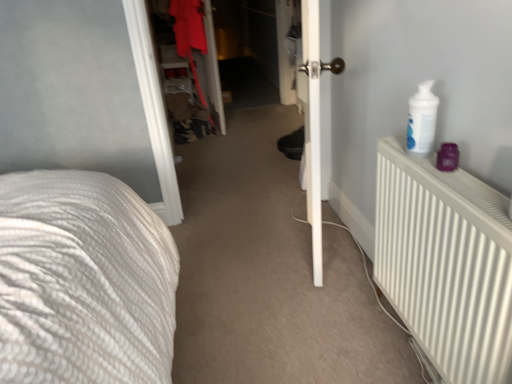
What do you see at coordinates (445, 263) in the screenshot? I see `white matte radiator at right` at bounding box center [445, 263].

Locate an element on the screen. This screenshot has height=384, width=512. white smooth door at center is located at coordinates (314, 124).

From a real-world perspective, who is located lower, matte red coat at center or white smooth door at center?

white smooth door at center is physically lower.

Consider the image. Is matte red coat at center positioned with its back to white smooth door at center?

No, matte red coat at center is not facing away from white smooth door at center.

Is matte red coat at center shorter than white smooth door at center?

Yes, matte red coat at center is shorter than white smooth door at center.

Looking at their sizes, would you say matte red coat at center is wider or thinner than white smooth door at center?

Clearly, matte red coat at center has more width compared to white smooth door at center.

In terms of width, does white smooth door at center look wider or thinner when compared to white matte radiator at right?

Considering their sizes, white smooth door at center looks broader than white matte radiator at right.

Is white matte radiator at right surrounded by white smooth door at center?

No, white matte radiator at right is not a part of white smooth door at center.

From a real-world perspective, who is located higher, white smooth door at center or matte red coat at center?

From a 3D spatial view, matte red coat at center is above.

Between white smooth door at center and matte red coat at center, which one has larger size?

With larger size is matte red coat at center.

Is white smooth door at center with matte red coat at center?

No, white smooth door at center is not making contact with matte red coat at center.

Is white smooth door at center aimed at matte red coat at center?

No, white smooth door at center is not aimed at matte red coat at center.

From a real-world perspective, is white matte radiator at right on white smooth door at center?

No, from a real-world perspective, white matte radiator at right is not over white smooth door at center

Consider the image. Which is more to the left, white matte radiator at right or white smooth door at center?

Positioned to the left is white smooth door at center.

Can you confirm if white matte radiator at right is bigger than white smooth door at center?

No, white matte radiator at right is not bigger than white smooth door at center.

Can you confirm if matte red coat at center is bigger than white matte radiator at right?

Indeed, matte red coat at center has a larger size compared to white matte radiator at right.

In the image, is matte red coat at center positioned in front of or behind white matte radiator at right?

Clearly, matte red coat at center is behind white matte radiator at right.

From a real-world perspective, between matte red coat at center and white matte radiator at right, who is vertically higher?

matte red coat at center.

In terms of height, does matte red coat at center look taller or shorter compared to white matte radiator at right?

Considering their sizes, matte red coat at center has more height than white matte radiator at right.

In the scene shown: Is white matte radiator at right taller than matte red coat at center?

Incorrect, the height of white matte radiator at right is not larger of that of matte red coat at center.

Is white matte radiator at right thinner than matte red coat at center?

Correct, the width of white matte radiator at right is less than that of matte red coat at center.

Does point (482, 234) come closer to viewer compared to point (201, 44)?

That is True.

Image resolution: width=512 pixels, height=384 pixels. Identify the location of clothing above the white matte radiator at right (from the image's perspective). (189, 34).

Locate an element on the screen. door to the right of matte red coat at center is located at coordinates (314, 124).

Where is `door above the white matte radiator at right (from the image's perspective)`? Image resolution: width=512 pixels, height=384 pixels. door above the white matte radiator at right (from the image's perspective) is located at coordinates (314, 124).

From the image, which object appears to be nearer to white smooth door at center, matte red coat at center or white matte radiator at right?

Among the two, white matte radiator at right is located nearer to white smooth door at center.

Based on their spatial positions, is white smooth door at center or matte red coat at center further from white matte radiator at right?

Based on the image, matte red coat at center appears to be further to white matte radiator at right.

Estimate the real-world distances between objects in this image. Which object is closer to white smooth door at center, white matte radiator at right or matte red coat at center?

white matte radiator at right is closer to white smooth door at center.

Based on the photo, considering their positions, is white smooth door at center positioned closer to matte red coat at center than white matte radiator at right?

white smooth door at center is positioned closer to the anchor matte red coat at center.

Looking at the image, which one is located further to matte red coat at center, white matte radiator at right or white smooth door at center?

The object further to matte red coat at center is white matte radiator at right.

Considering their positions, is matte red coat at center positioned further to white matte radiator at right than white smooth door at center?

matte red coat at center.

The image size is (512, 384). I want to click on door positioned between white matte radiator at right and matte red coat at center from near to far, so click(x=314, y=124).